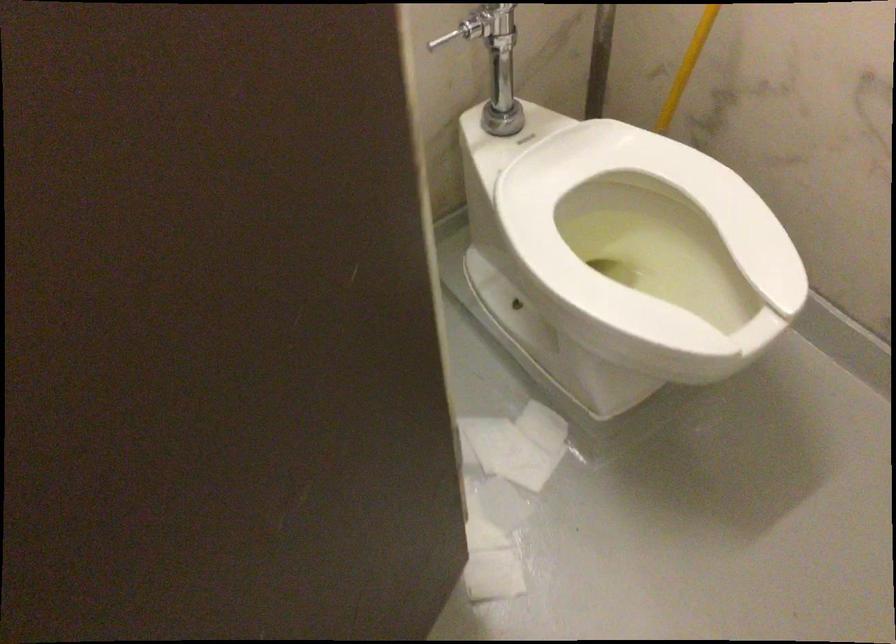
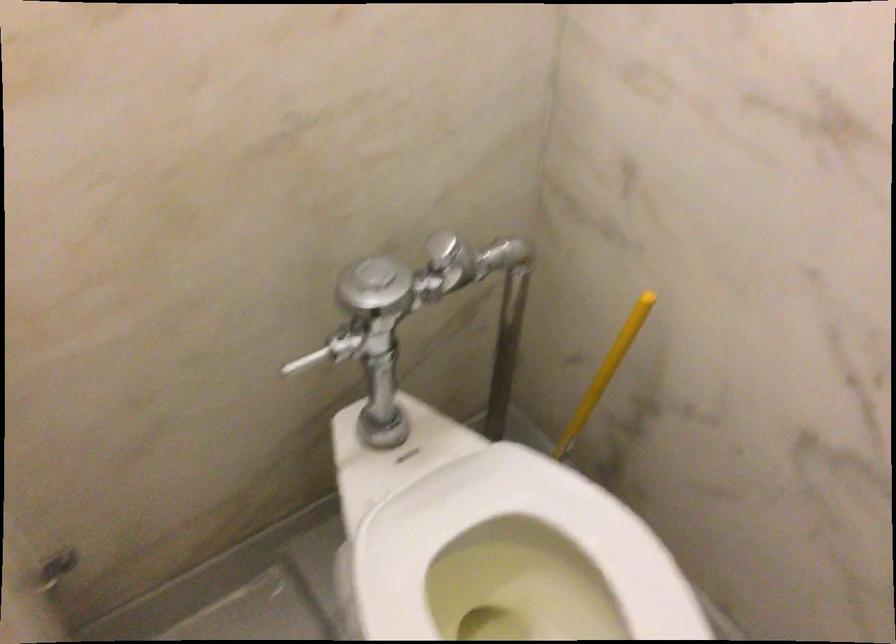
The images are taken continuously from a first-person perspective. In which direction are you moving?

The cameraman walked toward right, forward.